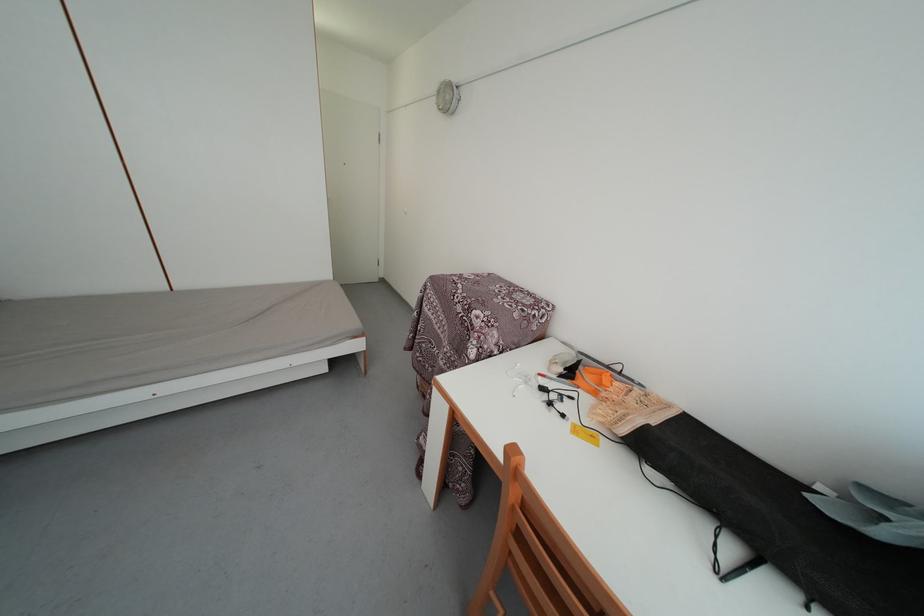
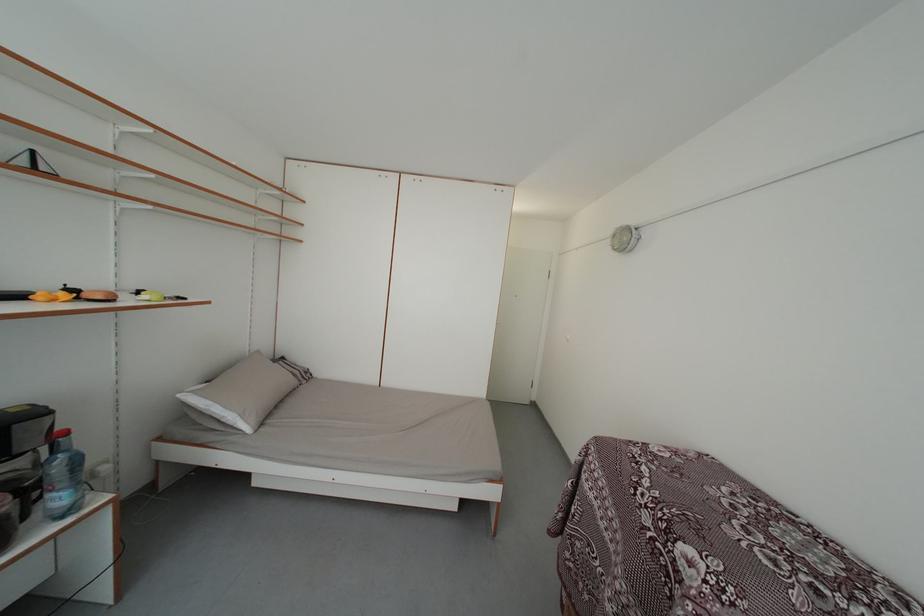
The first image is from the beginning of the video and the second image is from the end. How did the camera likely rotate when shooting the video?

The camera rotated toward left-up.